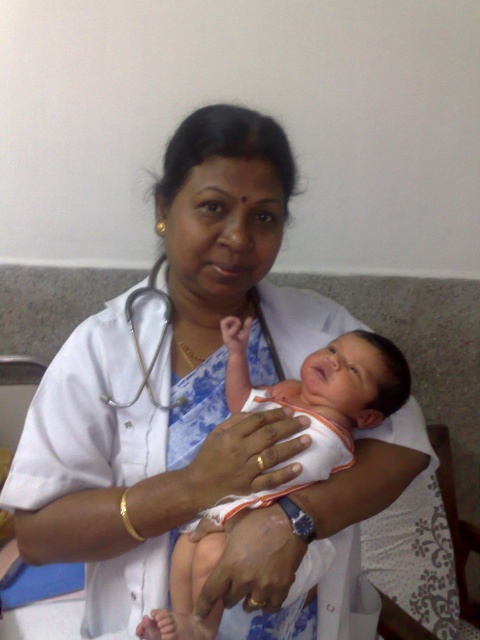
Measure the distance between white cotton newborn at center and camera.

31.09 inches

Who is shorter, white cotton newborn at center or white matte stethoscope at center?

Standing shorter between the two is white matte stethoscope at center.

Is point (287, 380) in front of point (160, 337)?

Yes, it is in front of point (160, 337).

At what (x,y) coordinates should I click in order to perform the action: click on white cotton newborn at center. Please return your answer as a coordinate pair (x, y). Looking at the image, I should click on (290, 458).